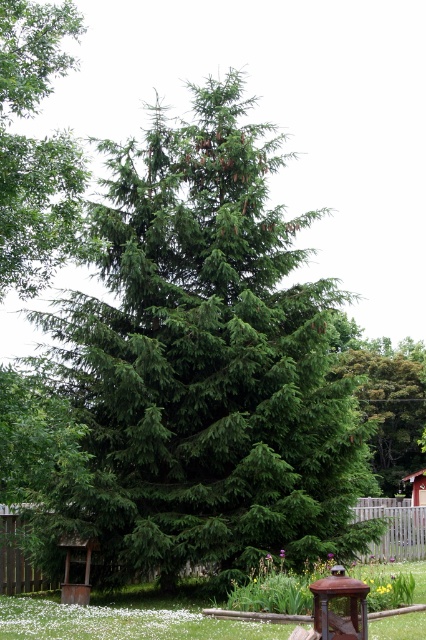
You are a bird flying towards the green matte tree at upper left and the green matte tree at center. Which tree will you reach first?

The green matte tree at upper left is in front of the green matte tree at center, so you will reach the green matte tree at upper left first.

Looking at this image, you are a bird flying towards the green matte tree at center and the green matte tree at upper left. Which tree should you land on first if you want to reach the lower one?

You should land on the green matte tree at center first because it is lower than the green matte tree at upper left, which is positioned above it.

You are a park ranger planning to place a new bench between the green matte tree at upper left and the green matte tree at center. The bench requires a minimum of 25 meters of space between the two trees to be placed safely. Can you place the bench there?

The green matte tree at upper left and green matte tree at center are 30.64 meters apart from each other. Since the required minimum space is 25 meters, the bench can be placed there as the distance is sufficient.